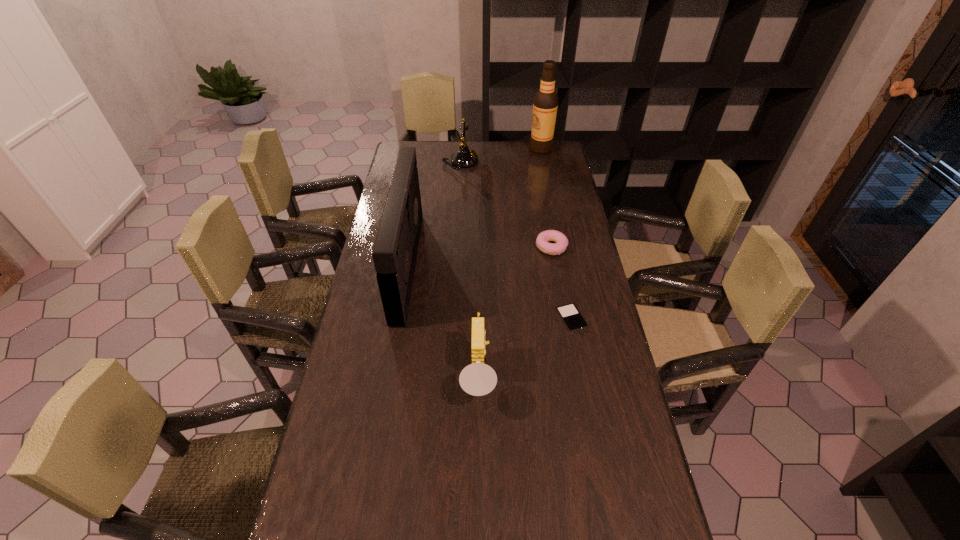
Locate an element on the screen. The image size is (960, 540). alcohol is located at coordinates tap(545, 103).

Locate an element on the screen. Image resolution: width=960 pixels, height=540 pixels. the leftmost object is located at coordinates (394, 254).

Where is `the fifth shortest object`? This screenshot has width=960, height=540. the fifth shortest object is located at coordinates (394, 254).

The image size is (960, 540). Find the location of `telephone`. telephone is located at coordinates (463, 158).

You are a GUI agent. You are given a task and a screenshot of the screen. Output one action in this format:
    pyautogui.click(x=<x>, y=<y>)
    Task: Click on the sponge
    The height and width of the screenshot is (540, 960).
    Given the screenshot: What is the action you would take?
    pyautogui.click(x=477, y=379)

Find the location of `the fifth tallest object`. the fifth tallest object is located at coordinates (561, 242).

Image resolution: width=960 pixels, height=540 pixels. In order to click on the shortest object in this screenshot , I will do `click(573, 320)`.

What are the coordinates of `vacant space located 0.300m on the label of the alcohol` in the screenshot? It's located at (467, 150).

The height and width of the screenshot is (540, 960). I want to click on vacant space located on the label of the alcohol, so point(472,150).

The height and width of the screenshot is (540, 960). I want to click on vacant space situated 0.290m on the label of the alcohol, so click(x=468, y=150).